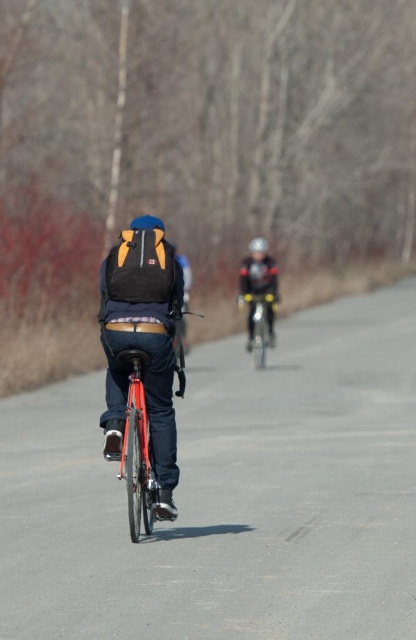
Question: Can you confirm if shiny black helmet at center is positioned above metallic silver bicycle at center?

Choices:
 (A) yes
 (B) no

Answer: (B)

Question: Is shiny black helmet at center positioned in front of metallic silver bicycle at center?

Choices:
 (A) yes
 (B) no

Answer: (B)

Question: Which of the following is the closest to the observer?

Choices:
 (A) metallic silver bicycle at center
 (B) shiny black helmet at center
 (C) matte black helmet at center

Answer: (A)

Question: Which of the following is the closest to the observer?

Choices:
 (A) (259, 236)
 (B) (254, 346)
 (C) (250, 332)

Answer: (B)

Question: Is shiny black helmet at center bigger than matte black helmet at center?

Choices:
 (A) yes
 (B) no

Answer: (B)

Question: Which point is closer to the camera?

Choices:
 (A) (257, 243)
 (B) (247, 266)
 (C) (267, 324)

Answer: (C)